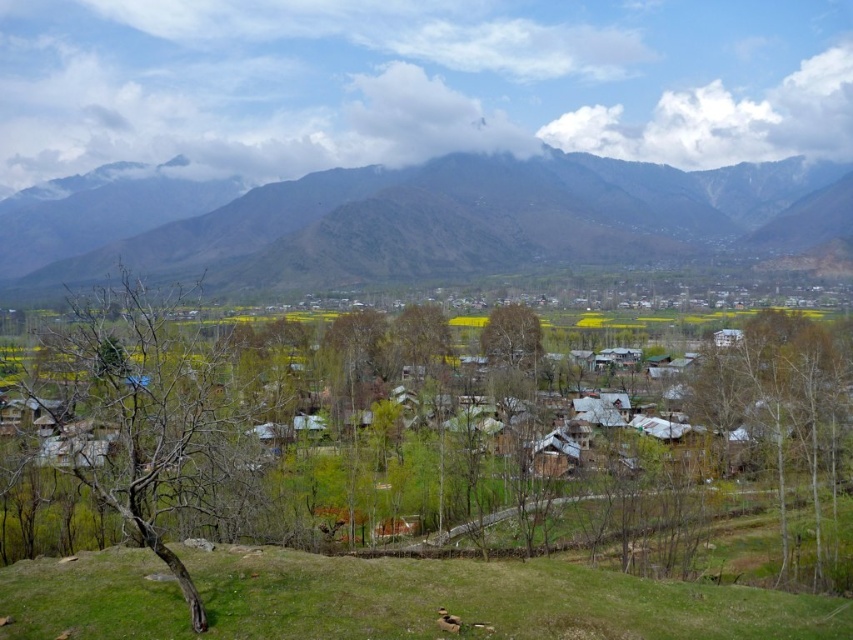
Question: Among these points, which one is farthest from the camera?

Choices:
 (A) (570, 493)
 (B) (106, 320)
 (C) (166, 609)
 (D) (444, 358)

Answer: (D)

Question: Can you confirm if brown leafless tree at center-left is smaller than green grassy hillside at lower center?

Choices:
 (A) yes
 (B) no

Answer: (B)

Question: Is brown rocky mountain at upper center closer to the viewer compared to bare wood tree at right?

Choices:
 (A) yes
 (B) no

Answer: (B)

Question: Which of the following is the farthest from the observer?

Choices:
 (A) green leafy tree at center
 (B) bare wood tree at right
 (C) brown rocky mountain at upper center

Answer: (C)

Question: Does brown leafless tree at center-left appear under bare wood tree at right?

Choices:
 (A) no
 (B) yes

Answer: (A)

Question: Considering the real-world distances, which object is farthest from the green grassy hillside at lower center?

Choices:
 (A) green leafy tree at center
 (B) bare wood tree at right

Answer: (A)